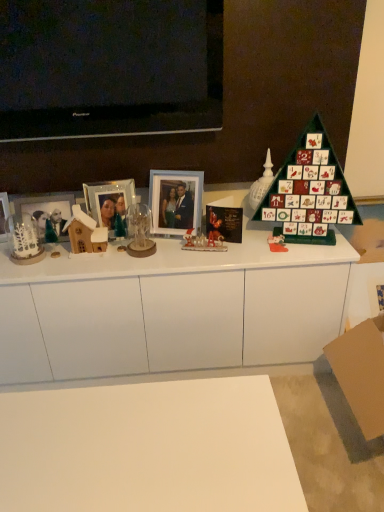
Locate an element on the screen. The width and height of the screenshot is (384, 512). free space to the right of white glossy santa claus at center, marked as the fourth toy in a left-to-right arrangement is located at coordinates (241, 249).